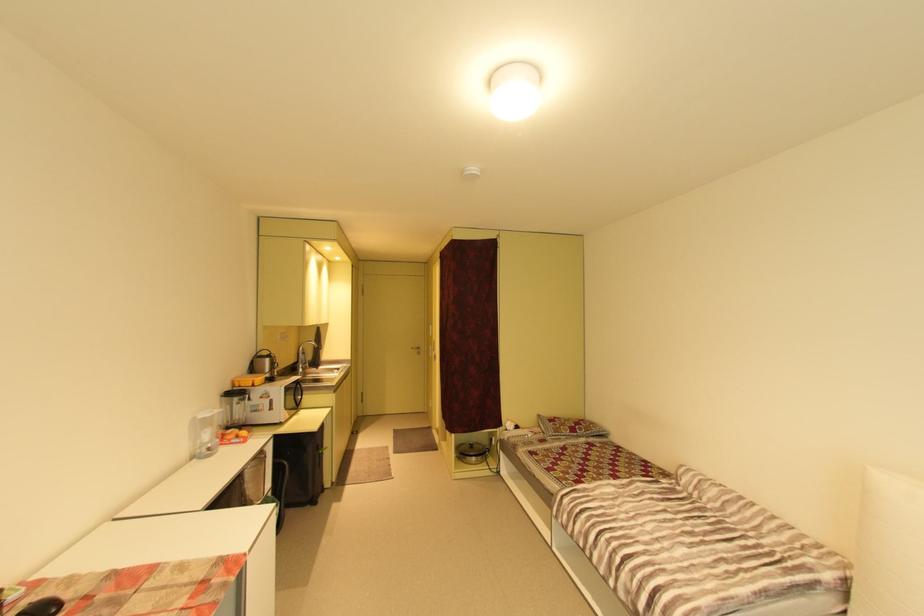
What do you see at coordinates (309, 361) in the screenshot?
I see `the faucet handle` at bounding box center [309, 361].